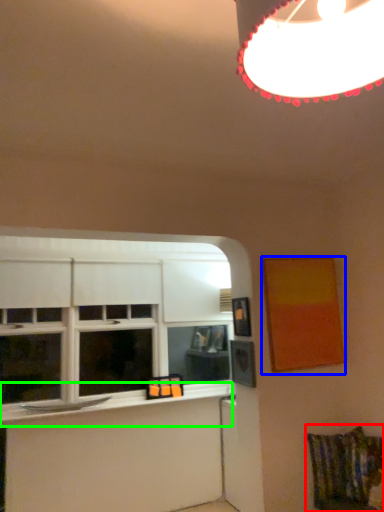
Question: Considering the real-world distances, which object is farthest from swivel chair (highlighted by a red box)? picture frame (highlighted by a blue box) or window sill (highlighted by a green box)?

Choices:
 (A) picture frame
 (B) window sill

Answer: (B)